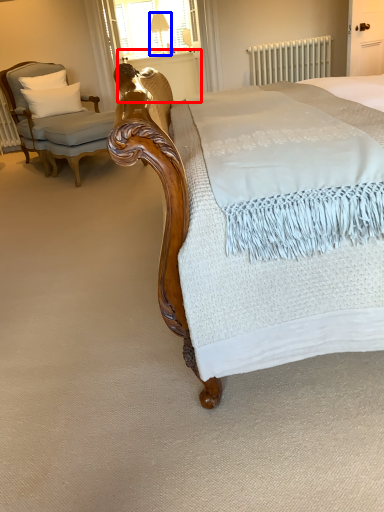
Question: Which object is closer to the camera taking this photo, balustrade (highlighted by a red box) or table lamp (highlighted by a blue box)?

Choices:
 (A) balustrade
 (B) table lamp

Answer: (A)